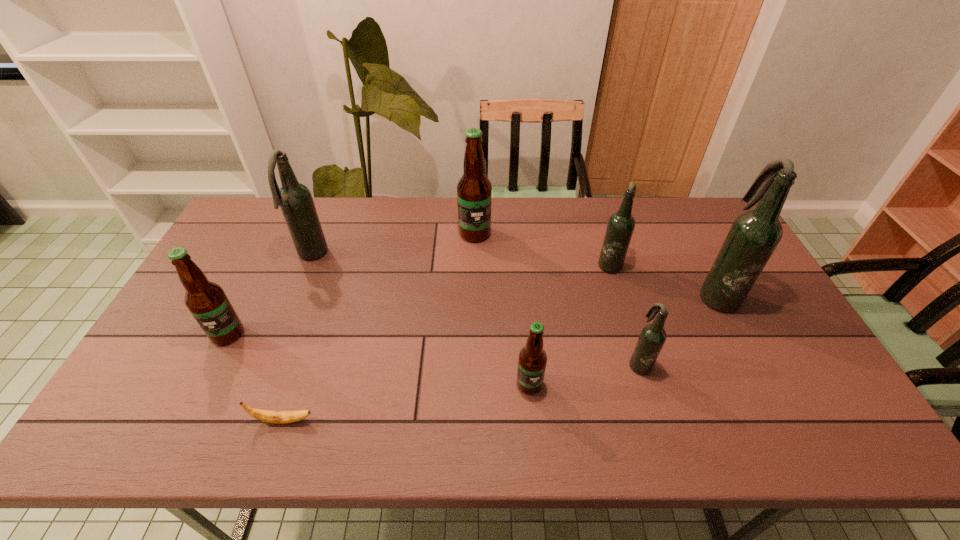
You are a GUI agent. You are given a task and a screenshot of the screen. Output one action in this format:
    pyautogui.click(x=<x>, y=<y>)
    Task: Click on the tallest object
    The image size is (960, 540).
    Given the screenshot: What is the action you would take?
    pyautogui.click(x=754, y=235)

What are the coordinates of `the second nearest dark beer bottle` in the screenshot? It's located at (754, 235).

The height and width of the screenshot is (540, 960). I want to click on the second beer bottle from left to right, so click(x=295, y=200).

In order to click on the leftmost dark beer bottle in this screenshot , I will do pyautogui.click(x=295, y=200).

Find the location of a particular element. Image resolution: width=960 pixels, height=540 pixels. the biggest brown beer bottle is located at coordinates [x=474, y=190].

At what (x,y) coordinates should I click in order to perform the action: click on the second brown beer bottle from right to left. Please return your answer as a coordinate pair (x, y). The image size is (960, 540). Looking at the image, I should click on (474, 190).

At what (x,y) coordinates should I click in order to perform the action: click on the second smallest dark beer bottle. Please return your answer as a coordinate pair (x, y). Looking at the image, I should click on (621, 224).

Where is `the third nearest beer bottle`? the third nearest beer bottle is located at coordinates (207, 302).

This screenshot has height=540, width=960. I want to click on the leftmost brown beer bottle, so click(207, 302).

At what (x,y) coordinates should I click in order to perform the action: click on the nearest dark beer bottle. Please return your answer as a coordinate pair (x, y). This screenshot has height=540, width=960. Looking at the image, I should click on (653, 336).